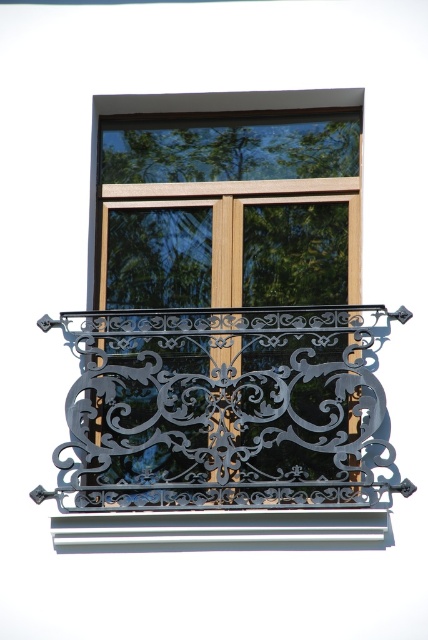
Who is more distant from viewer, [234,189] or [160,538]?

The point [234,189] is behind.

Is wooden at center wider than metallic silver window sill at lower center?

Yes.

The image size is (428, 640). What are the coordinates of `wooden at center` in the screenshot? It's located at (226, 216).

Is wooden at center further to the viewer compared to black wrought iron balcony at center?

That is False.

How distant is wooden at center from black wrought iron balcony at center?

6.50 meters

The image size is (428, 640). What do you see at coordinates (226, 216) in the screenshot?
I see `wooden at center` at bounding box center [226, 216].

Where is `wooden at center`? This screenshot has width=428, height=640. wooden at center is located at coordinates (226, 216).

Is black wrought iron balcony at center to the left of metallic silver window sill at lower center from the viewer's perspective?

Incorrect, black wrought iron balcony at center is not on the left side of metallic silver window sill at lower center.

Between point (369, 481) and point (288, 538), which one is positioned behind?

The point (369, 481) is more distant.

Does point (217, 324) lie behind point (152, 538)?

Yes, point (217, 324) is farther from viewer.

The image size is (428, 640). Find the location of `black wrought iron balcony at center`. black wrought iron balcony at center is located at coordinates (223, 426).